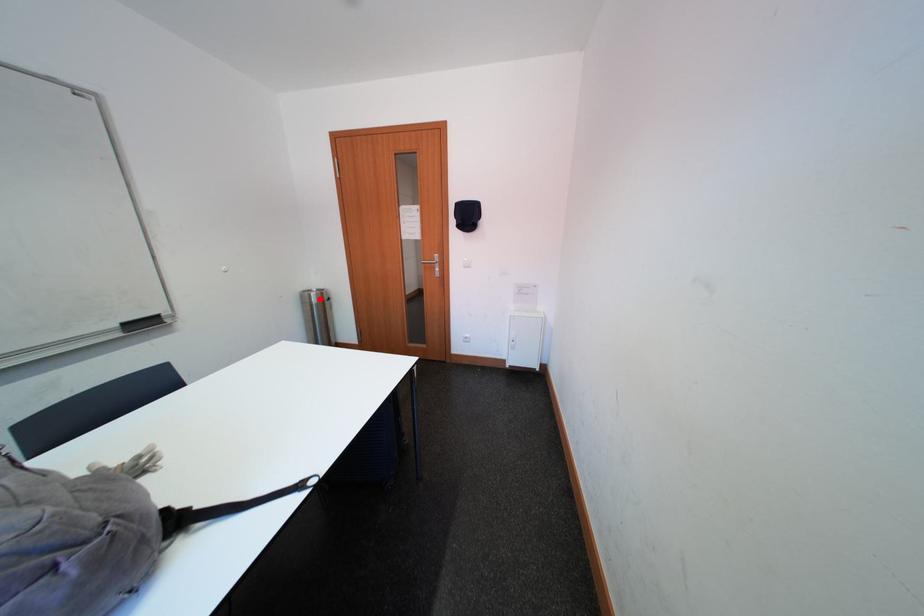
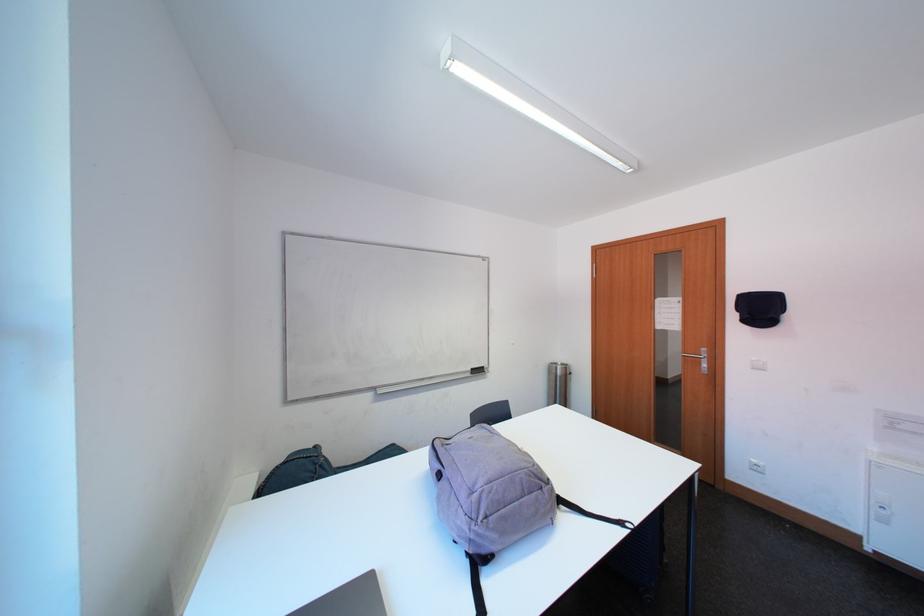
Question: I am providing you with two images of the same scene from different viewpoints. Given a red point in image1, look at the same physical point in image2. Is it:

Choices:
 (A) Closer to the viewpoint
 (B) Farther from the viewpoint

Answer: (B)